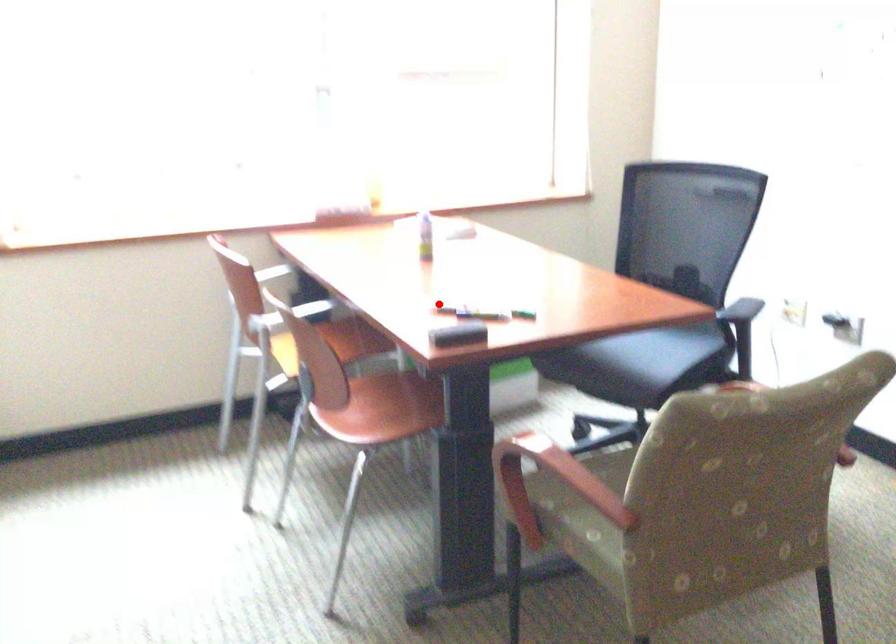
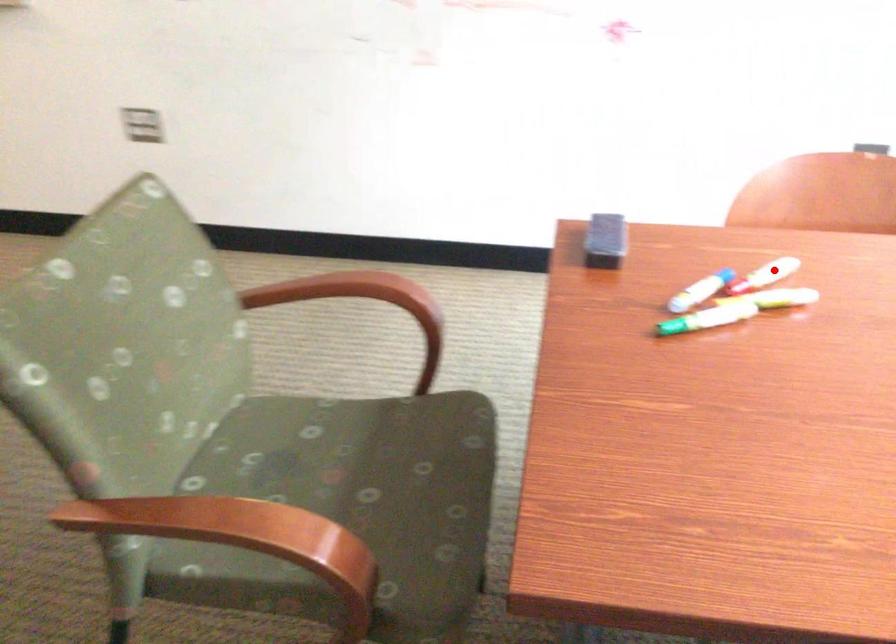
Consider the image. I am providing you with two images of the same scene from different viewpoints. A red point is marked on the first image and another point is marked on the second image. Is the marked point in image1 the same physical position as the marked point in image2?

Yes